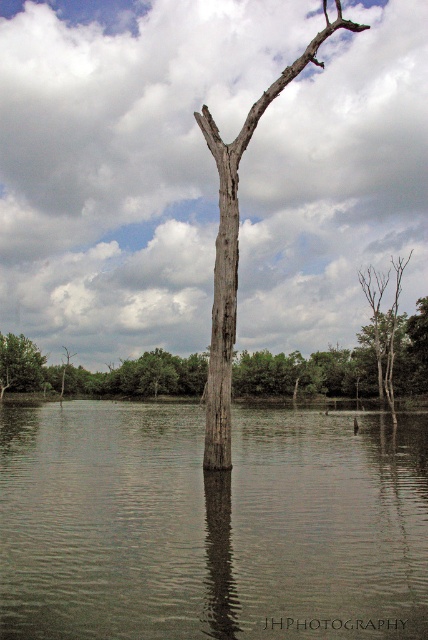
You are a photographer taking a picture of the brown matte tree trunk at center and the green matte tree at left. Which one will appear bigger in your photo?

The brown matte tree trunk at center appears bigger in the photo because it has a larger size compared to the green matte tree at left.

You are an environmental scientist assessing the health of a forest. You observe the brown matte tree trunk at center and the green matte tree at left. Which tree is shorter?

The brown matte tree trunk at center is shorter than the green matte tree at left.